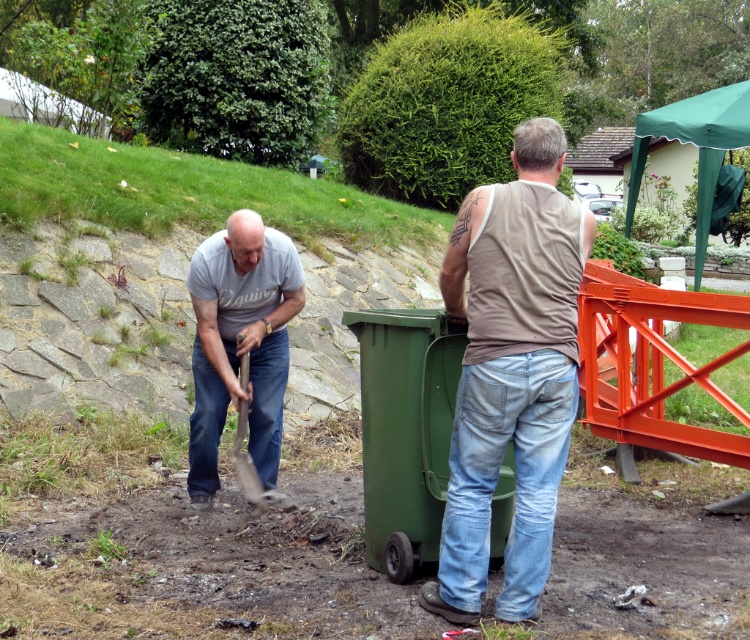
Who is higher up, brown cotton tank top at center or green plastic bin at center?

brown cotton tank top at center

From the picture: How far apart are brown cotton tank top at center and green plastic bin at center?

brown cotton tank top at center is 16.16 inches from green plastic bin at center.

What do you see at coordinates (510, 372) in the screenshot?
I see `brown cotton tank top at center` at bounding box center [510, 372].

This screenshot has width=750, height=640. What are the coordinates of `brown cotton tank top at center` in the screenshot? It's located at (510, 372).

How far apart are green plastic bin at center and wooden handle shovel at lower center?

green plastic bin at center and wooden handle shovel at lower center are 3.59 feet apart from each other.

Which is behind, point (442, 464) or point (286, 504)?

The point (286, 504) is behind.

Identify the location of green plastic bin at center. The width and height of the screenshot is (750, 640). (405, 429).

The width and height of the screenshot is (750, 640). What do you see at coordinates (510, 372) in the screenshot?
I see `brown cotton tank top at center` at bounding box center [510, 372].

Which is behind, point (536, 348) or point (252, 496)?

The point (252, 496) is more distant.

You are a GUI agent. You are given a task and a screenshot of the screen. Output one action in this format:
    pyautogui.click(x=<x>, y=<y>)
    Task: Click on the brown cotton tank top at center
    
    Given the screenshot: What is the action you would take?
    pyautogui.click(x=510, y=372)

Where is `brown cotton tank top at center`? The height and width of the screenshot is (640, 750). brown cotton tank top at center is located at coordinates (510, 372).